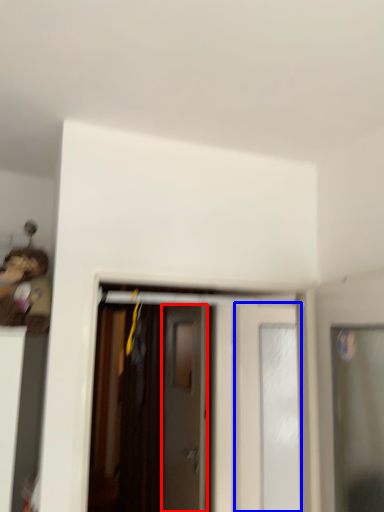
Question: Which point is further to the camera, door (highlighted by a red box) or door (highlighted by a blue box)?

Choices:
 (A) door
 (B) door

Answer: (A)